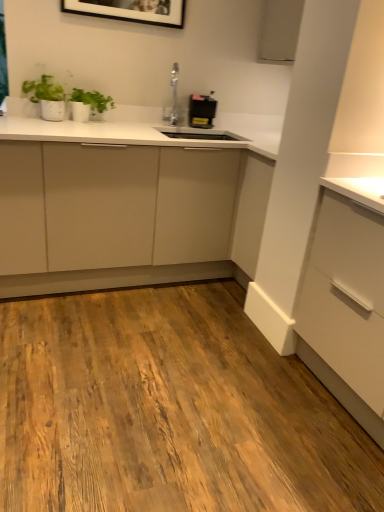
Question: In the image, is black plastic toaster at upper center positioned in front of or behind matte white cabinet at center?

Choices:
 (A) behind
 (B) front

Answer: (A)

Question: Would you say black plastic toaster at upper center is inside or outside matte white cabinet at center?

Choices:
 (A) inside
 (B) outside

Answer: (A)

Question: Which of these objects is positioned farthest from the black plastic toaster at upper center?

Choices:
 (A) matte white cabinet at center
 (B) matte white dresser at center
 (C) green matte plant at upper left

Answer: (A)

Question: Estimate the real-world distances between objects in this image. Which object is closer to the matte white dresser at center?

Choices:
 (A) black plastic toaster at upper center
 (B) green matte plant at upper left
 (C) matte white cabinet at center

Answer: (C)